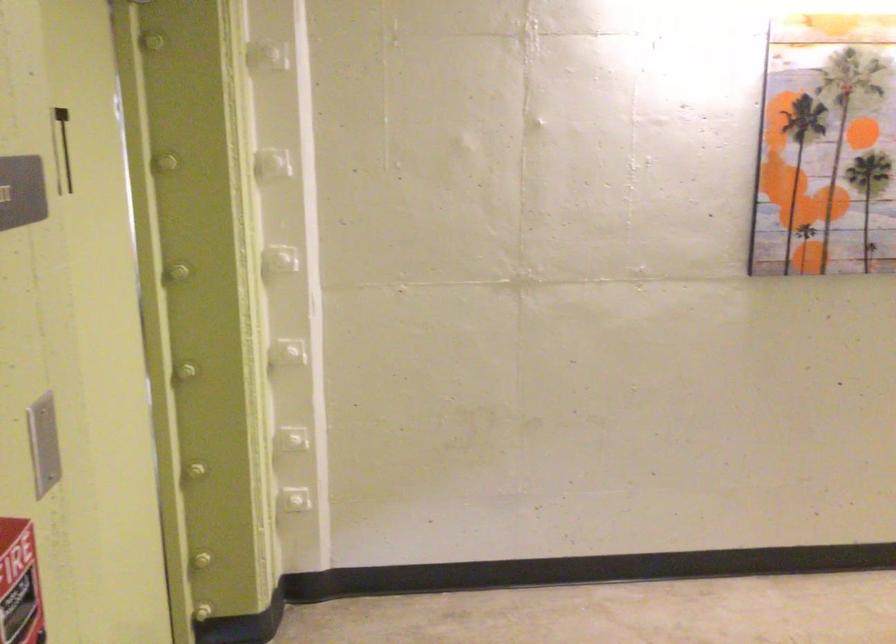
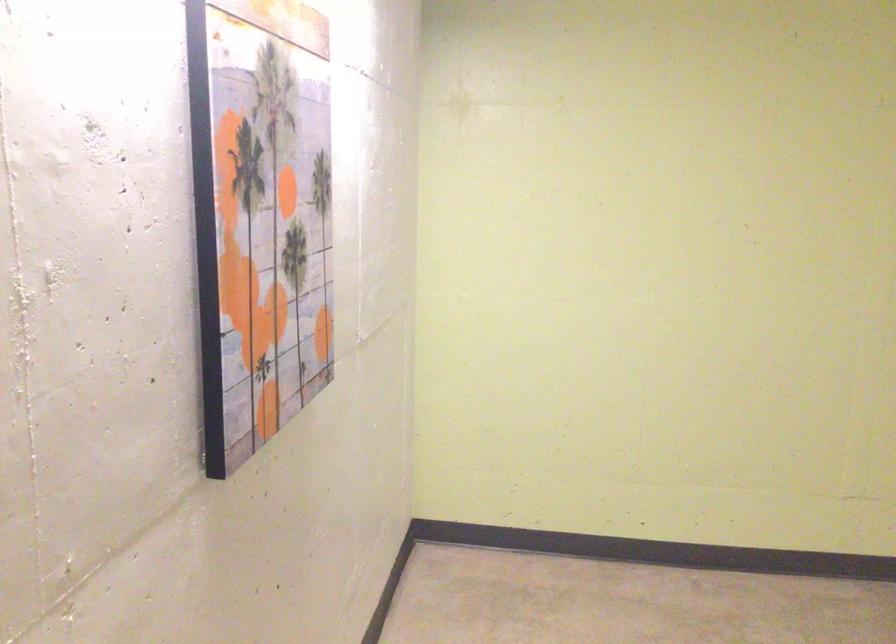
The point at (814, 149) is marked in the first image. Where is the corresponding point in the second image?

(260, 216)